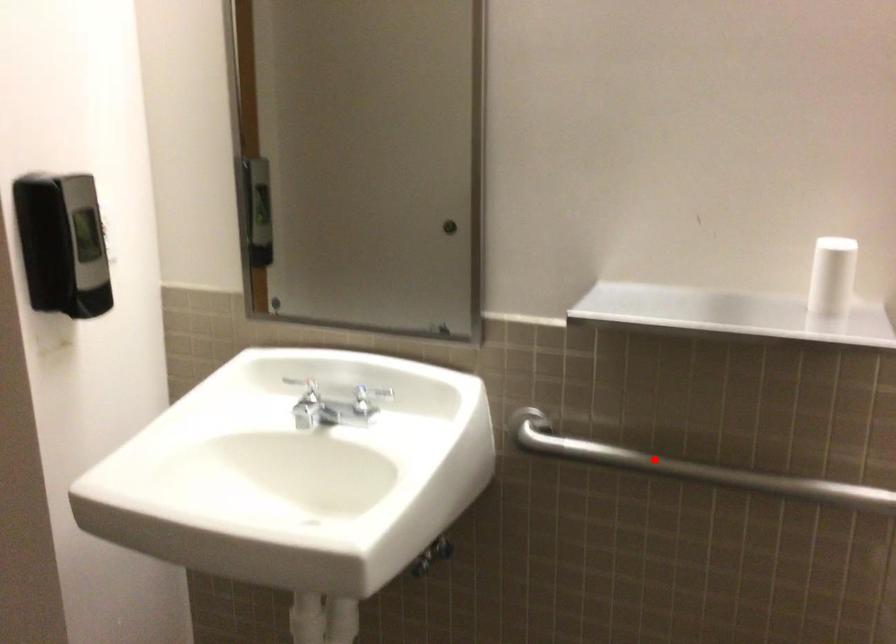
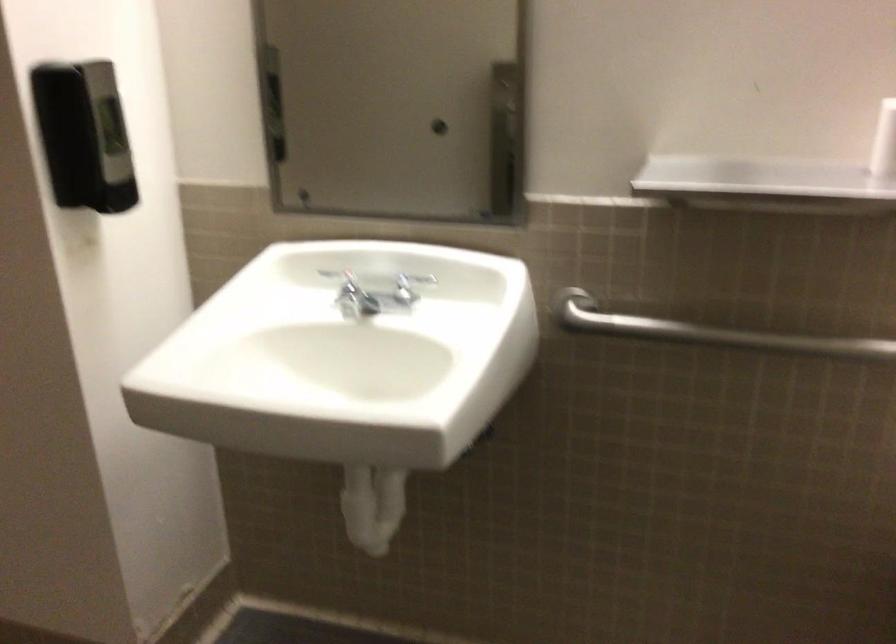
Where in the second image is the point corresponding to the highlighted location from the first image?

(707, 332)